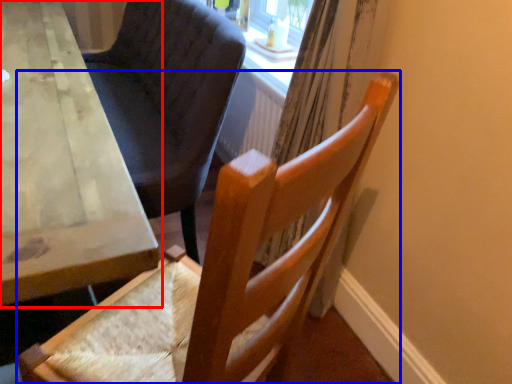
Question: Among these objects, which one is nearest to the camera, table (highlighted by a red box) or chair (highlighted by a blue box)?

Choices:
 (A) table
 (B) chair

Answer: (B)